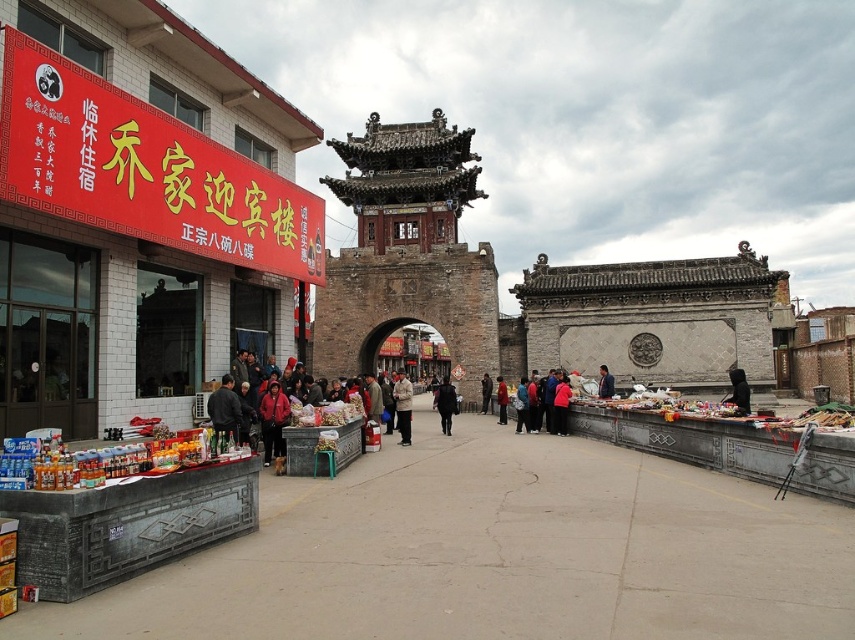
You are a delivery person with a cart that is 3 meters wide. You need to navigate between the red wool coat at center and the dark gray wool coat at center. Can your cart fit through the space between them?

The red wool coat at center and dark gray wool coat at center are 3.37 meters apart from each other. Since the cart is 3 meters wide, it can fit through the space between them as the distance is slightly larger than the cart width.